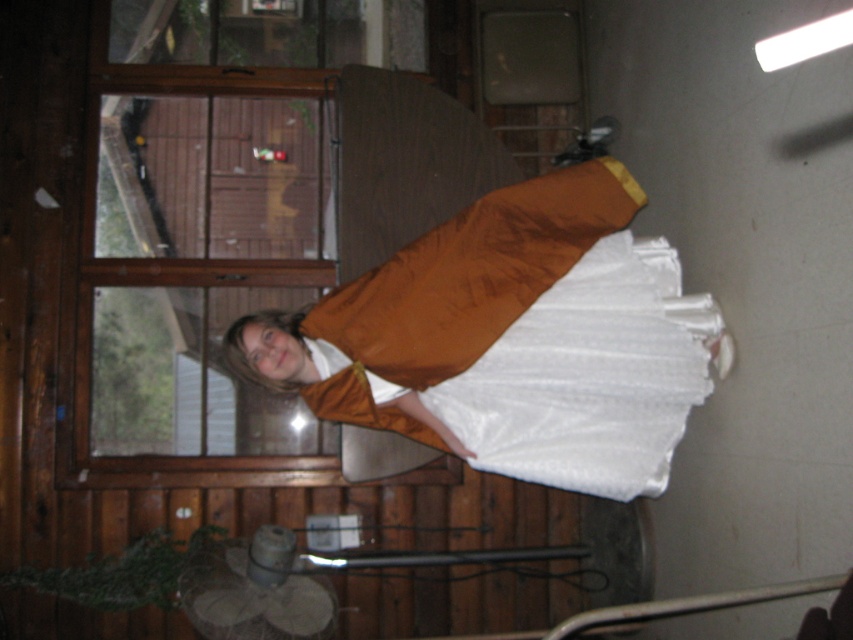
Between shiny brown cape at center and metallic silver rail at lower center, which one appears on the right side from the viewer's perspective?

metallic silver rail at lower center

Consider the image. Is shiny brown cape at center shorter than metallic silver rail at lower center?

Incorrect, shiny brown cape at center's height does not fall short of metallic silver rail at lower center's.

Who is more forward, (434, 358) or (576, 628)?

Point (434, 358)

Identify the location of shiny brown cape at center. (517, 339).